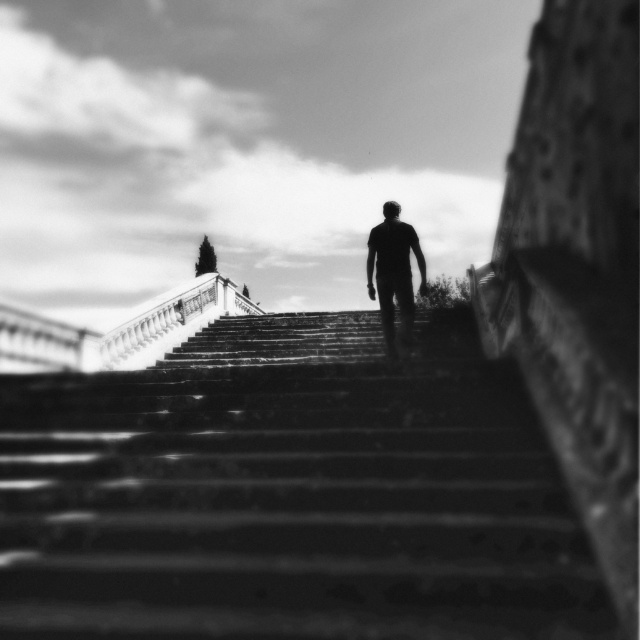
Is point (116, 506) more distant than point (380, 282)?

That is False.

Which is below, smooth stone stairs at center or silhouette figure at center?

smooth stone stairs at center

Locate an element on the screen. The height and width of the screenshot is (640, 640). smooth stone stairs at center is located at coordinates (289, 493).